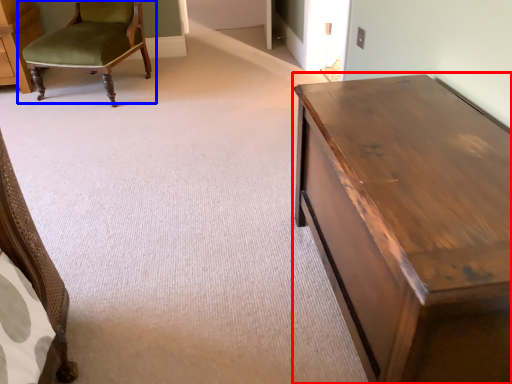
Question: Which point is closer to the camera, table (highlighted by a red box) or chair (highlighted by a blue box)?

Choices:
 (A) table
 (B) chair

Answer: (A)